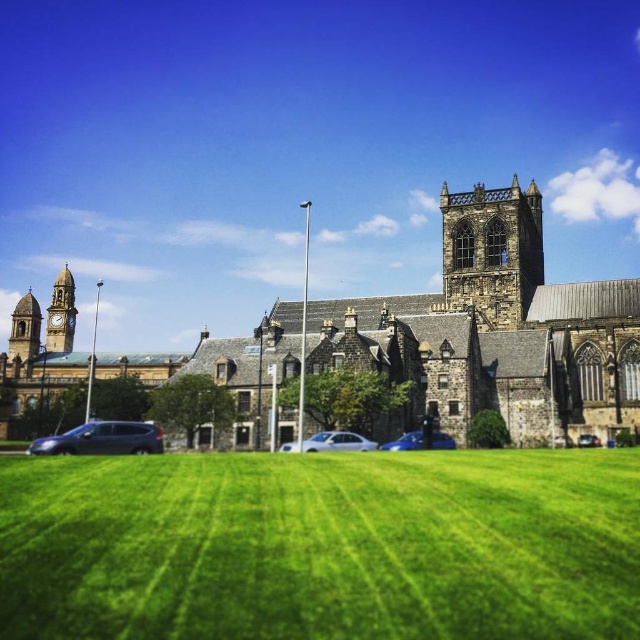
Question: Which point is closer to the camera taking this photo?

Choices:
 (A) (314, 449)
 (B) (22, 296)
 (C) (253, 621)
 (D) (65, 353)

Answer: (C)

Question: Does green grass at lower center have a larger size compared to white matte car at center?

Choices:
 (A) yes
 (B) no

Answer: (A)

Question: Considering the real-world distances, which object is farthest from the metallic silver car at lower left?

Choices:
 (A) dark gray stone church at center
 (B) stone clock tower at left
 (C) dark gray stone tower at center

Answer: (B)

Question: Which point is closer to the camera taking this photo?

Choices:
 (A) (554, 630)
 (B) (67, 337)
 (C) (60, 435)

Answer: (A)

Question: Can you confirm if green grass at lower center is thinner than white matte car at center?

Choices:
 (A) yes
 (B) no

Answer: (B)

Question: Is green grass at lower center to the right of stone clock tower at left from the viewer's perspective?

Choices:
 (A) yes
 (B) no

Answer: (A)